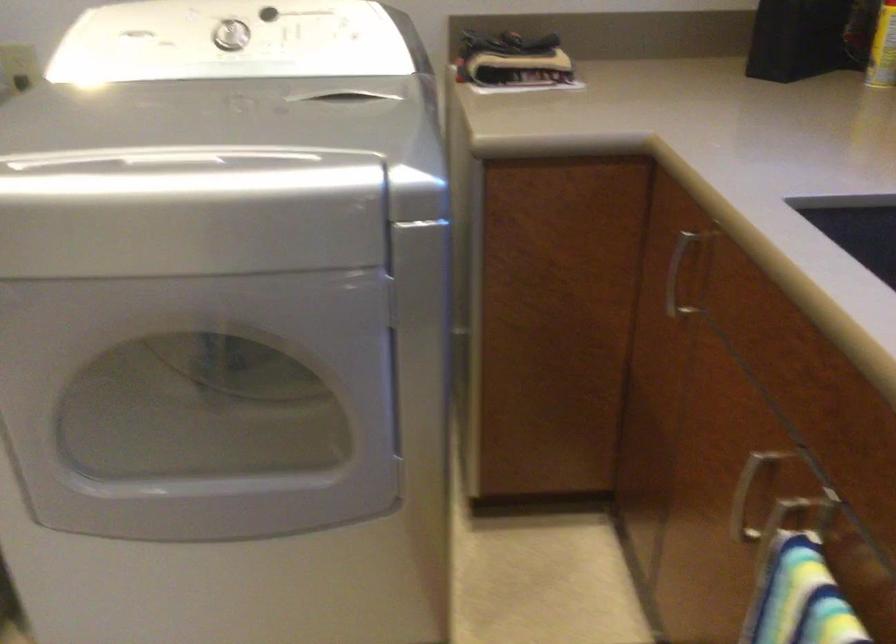
Describe the element at coordinates (178, 160) in the screenshot. I see `the dryer door handle` at that location.